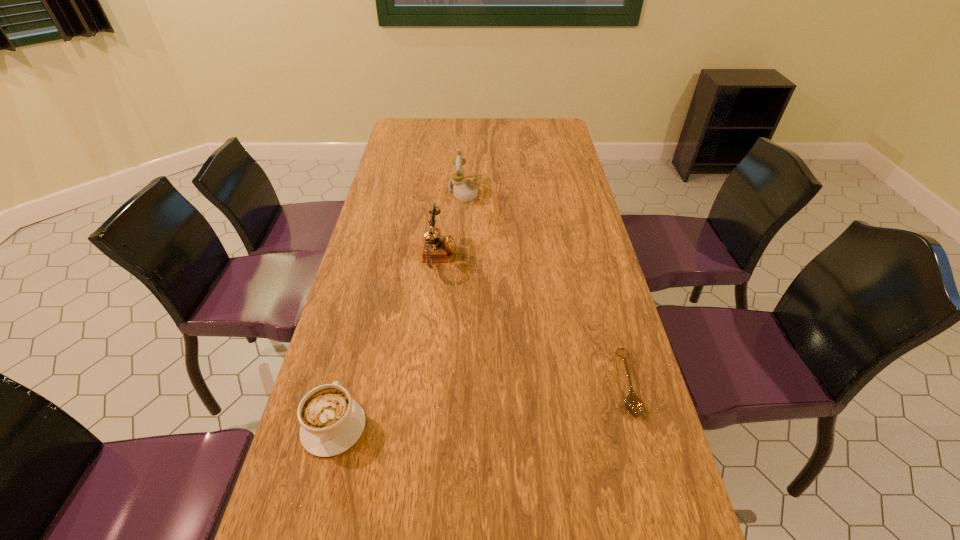
The height and width of the screenshot is (540, 960). I want to click on vacant region located to the right of the second shortest object's handle, so tap(367, 296).

This screenshot has height=540, width=960. In order to click on vacant space located 0.140m on the left of the shortest object in this screenshot , I will do `click(557, 383)`.

I want to click on object present at the left edge, so click(x=331, y=422).

At what (x,y) coordinates should I click in order to perform the action: click on object positioned at the right edge. Please return your answer as a coordinate pair (x, y). This screenshot has width=960, height=540. Looking at the image, I should click on (633, 404).

Where is `vacant space at the far edge of the desktop`? The image size is (960, 540). vacant space at the far edge of the desktop is located at coordinates [482, 118].

Identify the location of vacant space at the left edge of the desktop. (362, 369).

This screenshot has height=540, width=960. I want to click on free space at the right edge, so tap(568, 285).

In the image, there is a desktop. At what (x,y) coordinates should I click in order to perform the action: click on vacant space at the far right corner. Please return your answer as a coordinate pair (x, y). This screenshot has width=960, height=540. Looking at the image, I should click on (558, 129).

Identify the location of free spot between the nearer telephone and the shortest object. (533, 321).

This screenshot has height=540, width=960. Identify the location of unoccupied area between the second farthest object and the shortest object. (533, 321).